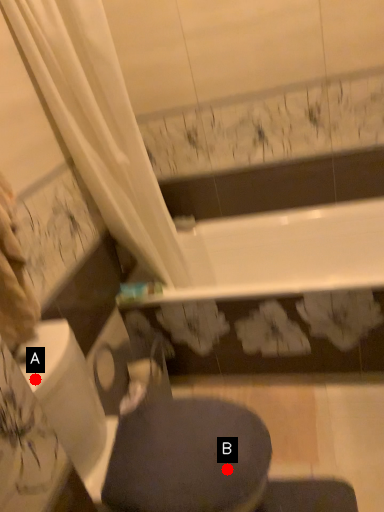
Question: Two points are circled on the image, labeled by A and B beside each circle. Among these points, which one is nearest to the camera?

Choices:
 (A) A is closer
 (B) B is closer

Answer: (A)